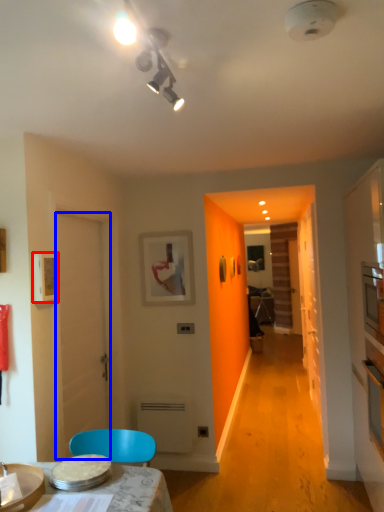
Question: Which of the following is the farthest to the observer, picture frame (highlighted by a red box) or door (highlighted by a blue box)?

Choices:
 (A) picture frame
 (B) door

Answer: (B)